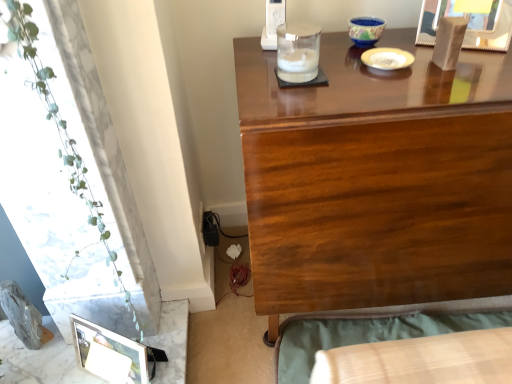
Find the location of a particular element. The height and width of the screenshot is (384, 512). vacant space that's between blue ceramic bowl at upper center, positioned as the first candle holder in right-to-left order, and clear glass candle holder at upper center, positioned as the first candle holder in left-to-right order is located at coordinates tap(339, 54).